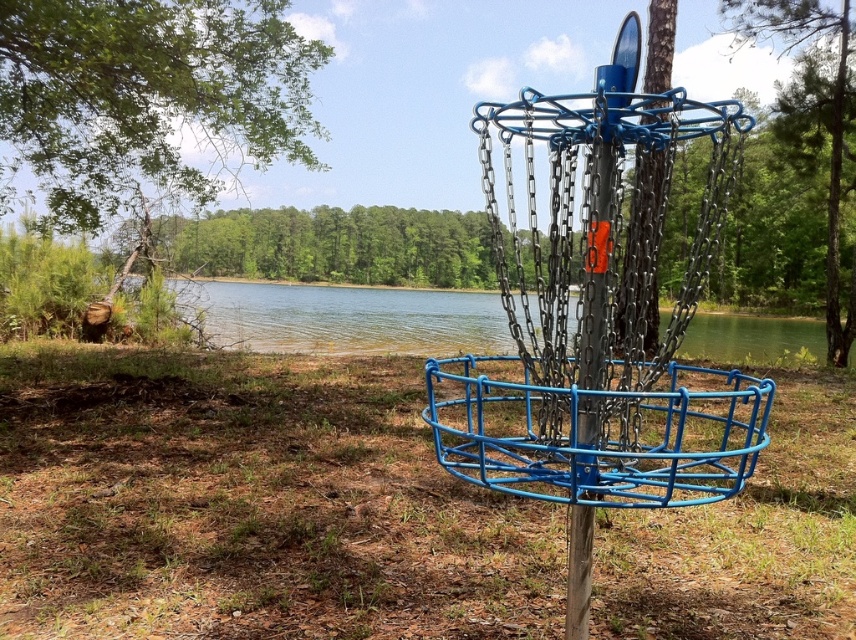
You are standing at the disc golf basket and want to throw a disc towards the green leafy tree at upper left. There is a point marked at coordinates point (146, 97). Is this point on the tree or somewhere else?

The point (146, 97) is on the green leafy tree at upper left.

You are standing at point (345, 317) in the scene. What do you see directly in front of you?

At point (345, 317) lies clear water at center, so you would see clear water at center directly in front of you.

You are standing at the edge of the clear water at center and want to reach the green leafy tree at center. Which direction should you walk to get closer to the tree?

The clear water at center is shorter than green leafy tree at center, so you should walk towards the direction of the green leafy tree at center to get closer to it.